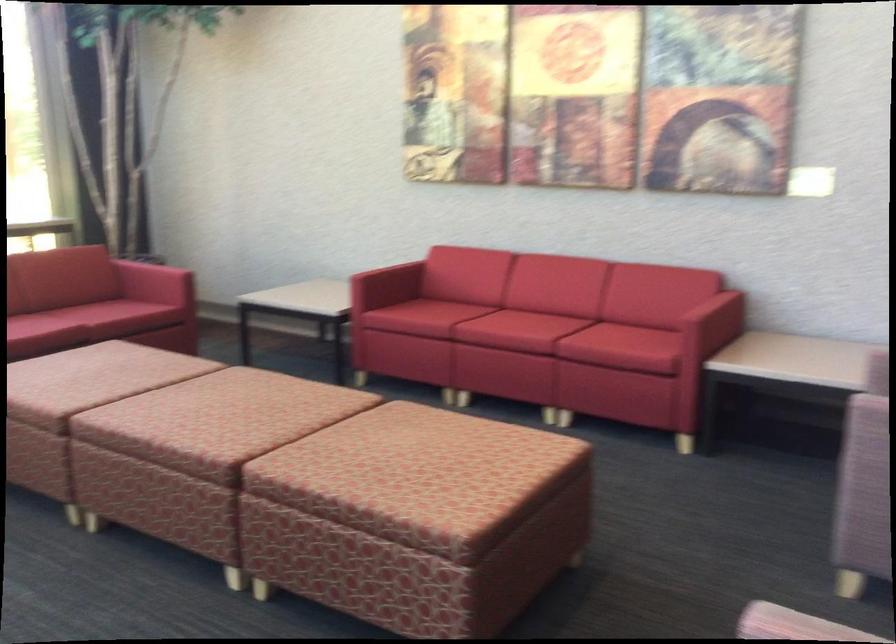
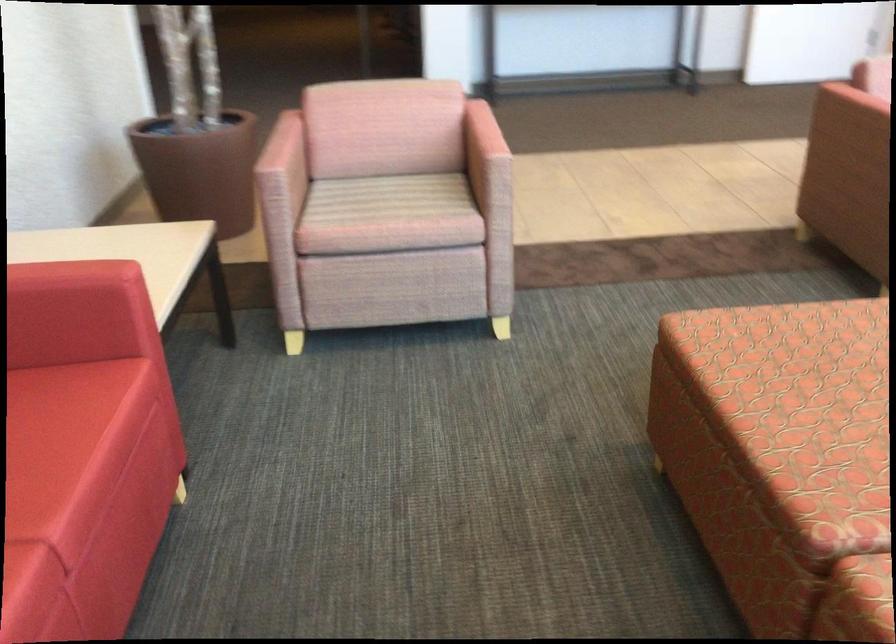
In the second image, find the point that corresponds to point (696, 303) in the first image.

(76, 272)